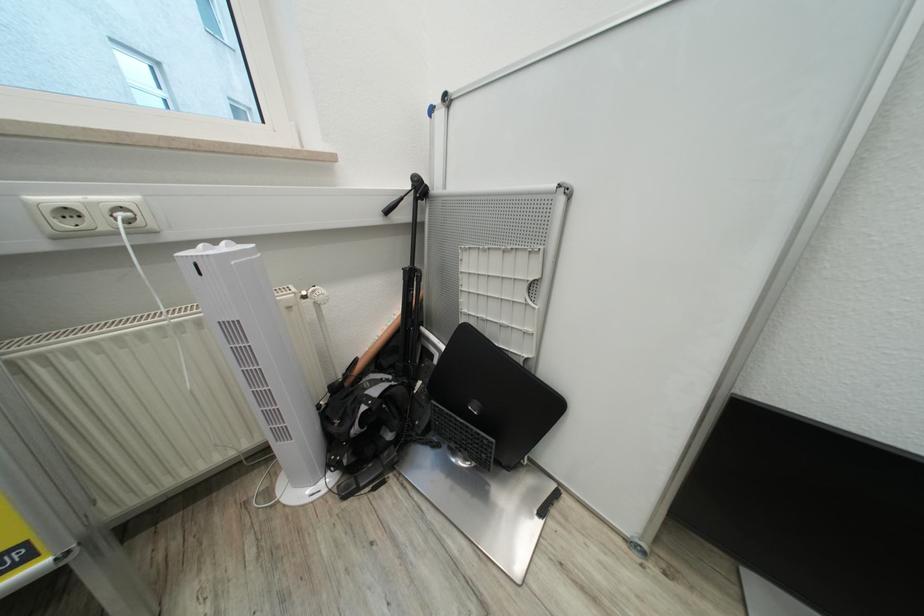
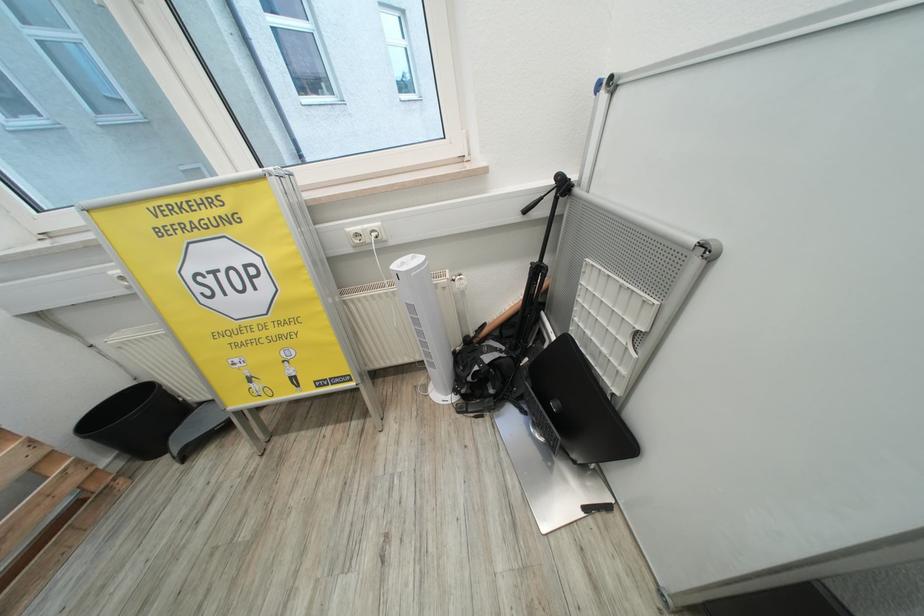
How did the camera likely rotate?

The camera's rotation is toward left-down.